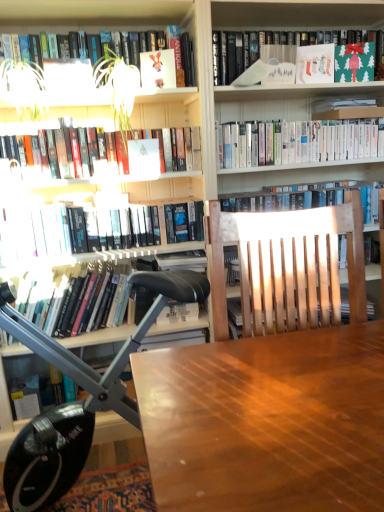
Describe the element at coordinates (96, 49) in the screenshot. This screenshot has height=512, width=384. I see `hardcover book at upper left, the sixth book positioned from the bottom` at that location.

Locate an element on the screen. Image resolution: width=384 pixels, height=512 pixels. hardcover book at upper center, placed as the third book when sorted from bottom to top is located at coordinates (286, 198).

Describe the element at coordinates (27, 127) in the screenshot. I see `hardcover books at upper left, arranged as the 4th book when viewed from the top` at that location.

Locate an element on the screen. This screenshot has width=384, height=512. green paper bag at upper right, marked as the 1th book in a top-to-bottom arrangement is located at coordinates (299, 58).

Find the location of `green leafy plant at upper left`. green leafy plant at upper left is located at coordinates (118, 88).

Which is less distant, (x=239, y=137) or (x=378, y=185)?

Point (x=239, y=137) is positioned closer to the camera compared to point (x=378, y=185).

In terms of size, does white glossy bookshelf at upper center, the 3th book viewed from the top, appear bigger or smaller than hardcover book at upper center, placed as the third book when sorted from bottom to top?

Clearly, white glossy bookshelf at upper center, the 3th book viewed from the top, is smaller in size than hardcover book at upper center, placed as the third book when sorted from bottom to top.

From the image's perspective, who appears lower, white glossy bookshelf at upper center, the 3th book viewed from the top, or hardcover book at upper center, placed as the third book when sorted from bottom to top?

hardcover book at upper center, placed as the third book when sorted from bottom to top, appears lower in the image.

From a real-world perspective, which book is the 1st one underneath the white glossy bookshelf at upper center, the 3th book viewed from the top? Please provide its 2D coordinates.

[(286, 198)]

Based on the photo, from the image's perspective, would you say wooden table at center is shown under matte white book at upper center, which is counted as the 4th paperback book, starting from the right?

Indeed, from the image's perspective, wooden table at center is shown beneath matte white book at upper center, which is counted as the 4th paperback book, starting from the right.

From a real-world perspective, does wooden table at center sit lower than matte white book at upper center, arranged as the first paperback book when viewed from the left?

Yes, from a real-world perspective, wooden table at center is below matte white book at upper center, arranged as the first paperback book when viewed from the left.

Does wooden table at center have a greater height compared to matte white book at upper center, which is counted as the 4th paperback book, starting from the right?

Indeed, wooden table at center has a greater height compared to matte white book at upper center, which is counted as the 4th paperback book, starting from the right.

Between point (316, 368) and point (173, 52), which one is positioned behind?

The point (173, 52) is farther.

Is white glossy bookshelf at upper center, which is the fifth book in bottom-to-top order, at the back of white paper at upper left, which ranks as the second book in bottom-to-top order?

That's not correct — white paper at upper left, which ranks as the second book in bottom-to-top order, is not looking away from white glossy bookshelf at upper center, which is the fifth book in bottom-to-top order.

Is white paper at upper left, acting as the sixth book starting from the top, not close to white glossy bookshelf at upper center, which is the fifth book in bottom-to-top order?

Actually, white paper at upper left, acting as the sixth book starting from the top, and white glossy bookshelf at upper center, which is the fifth book in bottom-to-top order, are a little close together.

Locate an element on the screen. The width and height of the screenshot is (384, 512). book that is the 2nd one above the white paper at upper left, acting as the sixth book starting from the top (from a real-world perspective) is located at coordinates (326, 141).

Where is `the 3rd book in front of the hardcover book at upper center, placed as the third book when sorted from bottom to top, counting from the anchor's position`? the 3rd book in front of the hardcover book at upper center, placed as the third book when sorted from bottom to top, counting from the anchor's position is located at coordinates (178, 258).

Considering the relative positions of hardcover book at upper center, placed as the third book when sorted from bottom to top, and hardcover book at left, which appears as the 7th book when viewed from the top, in the image provided, is hardcover book at upper center, placed as the third book when sorted from bottom to top, behind hardcover book at left, which appears as the 7th book when viewed from the top,?

That is True.

Is hardcover book at upper center, placed as the third book when sorted from bottom to top, turned away from hardcover book at left, which appears as the 7th book when viewed from the top?

No, hardcover book at upper center, placed as the third book when sorted from bottom to top,'s orientation is not away from hardcover book at left, which appears as the 7th book when viewed from the top.

Is hardcover book at upper center, placed as the third book when sorted from bottom to top, outside of green matte paper at upper right, marked as the 1th paperback book in a right-to-left arrangement?

That's correct, hardcover book at upper center, placed as the third book when sorted from bottom to top, is outside of green matte paper at upper right, marked as the 1th paperback book in a right-to-left arrangement.

How different are the orientations of hardcover book at upper center, placed as the third book when sorted from bottom to top, and green matte paper at upper right, marked as the 1th paperback book in a right-to-left arrangement, in degrees?

They differ by 25.4 degrees in their facing directions.

The height and width of the screenshot is (512, 384). I want to click on book that is the 4th object located below the green matte paper at upper right, marked as the 1th paperback book in a right-to-left arrangement (from the image's perspective), so click(286, 198).

Is hardcover book at upper center, the fifth book from the top, oriented towards green matte paper at upper right, marked as the 1th paperback book in a right-to-left arrangement?

No, hardcover book at upper center, the fifth book from the top, is not oriented towards green matte paper at upper right, marked as the 1th paperback book in a right-to-left arrangement.

Considering the sizes of objects white glossy bookshelf at upper center, the 3th book viewed from the top, and matte paper stocking at upper right, marked as the 3th paperback book in a left-to-right arrangement, in the image provided, who is thinner, white glossy bookshelf at upper center, the 3th book viewed from the top, or matte paper stocking at upper right, marked as the 3th paperback book in a left-to-right arrangement,?

Thinner between the two is matte paper stocking at upper right, marked as the 3th paperback book in a left-to-right arrangement.

Is white glossy bookshelf at upper center, which is the fifth book in bottom-to-top order, far from matte paper stocking at upper right, marked as the 3th paperback book in a left-to-right arrangement?

No.

Could you tell me if white glossy bookshelf at upper center, which is the fifth book in bottom-to-top order, is turned towards matte paper stocking at upper right, arranged as the 2th paperback book when viewed from the right?

No, white glossy bookshelf at upper center, which is the fifth book in bottom-to-top order, is not oriented towards matte paper stocking at upper right, arranged as the 2th paperback book when viewed from the right.

Is point (330, 143) in front of point (326, 47)?

No, it is not.

Between wooden table at center and green paper bag at upper right, marked as the 1th book in a top-to-bottom arrangement, which one appears on the right side from the viewer's perspective?

green paper bag at upper right, marked as the 1th book in a top-to-bottom arrangement.

How distant is wooden table at center from green paper bag at upper right, which is the seventh book from bottom to top?

wooden table at center is 4.31 feet away from green paper bag at upper right, which is the seventh book from bottom to top.

Does wooden table at center have a greater height compared to green paper bag at upper right, which is the seventh book from bottom to top?

Correct, wooden table at center is much taller as green paper bag at upper right, which is the seventh book from bottom to top.

Looking at this image, considering the relative sizes of wooden table at center and green paper bag at upper right, which is the seventh book from bottom to top, in the image provided, is wooden table at center thinner than green paper bag at upper right, which is the seventh book from bottom to top,?

No, wooden table at center is not thinner than green paper bag at upper right, which is the seventh book from bottom to top.

This screenshot has width=384, height=512. What are the coordinates of `book that is the 1st one below the white glossy bookshelf at upper center, the 3th book viewed from the top (from a real-world perspective)` in the screenshot? It's located at (286, 198).

From the image's perspective, starting from the wooden table at center, which paperback book is the 1st one above? Please provide its 2D coordinates.

[(158, 69)]

Based on their spatial positions, is matte paper stocking at upper right, arranged as the 2th paperback book when viewed from the right, or hardcover books at upper left, placed as the fourth book when sorted from bottom to top, further from white glossy bookshelf at upper center, the 3th book viewed from the top?

The object further to white glossy bookshelf at upper center, the 3th book viewed from the top, is hardcover books at upper left, placed as the fourth book when sorted from bottom to top.

Based on the photo, when comparing their distances from white paper at upper left, which ranks as the second book in bottom-to-top order, does green leafy plant at upper left or green matte paper at upper right, marked as the 1th paperback book in a right-to-left arrangement, seem further?

The object further to white paper at upper left, which ranks as the second book in bottom-to-top order, is green matte paper at upper right, marked as the 1th paperback book in a right-to-left arrangement.

Considering their positions, is hardcover book at left, which appears as the 7th book when viewed from the top, positioned further to matte paper stocking at upper right, marked as the 3th paperback book in a left-to-right arrangement, than hardcover books at upper left, arranged as the 4th book when viewed from the top?

The object further to matte paper stocking at upper right, marked as the 3th paperback book in a left-to-right arrangement, is hardcover book at left, which appears as the 7th book when viewed from the top.

Looking at the image, which one is located closer to green paper bag at upper right, which is the seventh book from bottom to top, black leather chair at left or hardcover book at left, which appears as the 7th book when viewed from the top?

hardcover book at left, which appears as the 7th book when viewed from the top.

Based on their spatial positions, is matte white book at upper center, arranged as the first paperback book when viewed from the left, or matte paper at upper center, the third paperback book when ordered from right to left, closer to green matte paper at upper right, which is the 4th paperback book from left to right?

matte paper at upper center, the third paperback book when ordered from right to left, lies closer to green matte paper at upper right, which is the 4th paperback book from left to right, than the other object.

When comparing their distances from white paper at upper left, which ranks as the second book in bottom-to-top order, does black leather chair at left or hardcover books at upper left, arranged as the 4th book when viewed from the top, seem closer?

Among the two, hardcover books at upper left, arranged as the 4th book when viewed from the top, is located nearer to white paper at upper left, which ranks as the second book in bottom-to-top order.

Looking at the image, which one is located closer to matte white book at upper center, arranged as the first paperback book when viewed from the left, matte paper at upper center, the third paperback book when ordered from right to left, or hardcover book at upper left, the sixth book positioned from the bottom?

Among the two, hardcover book at upper left, the sixth book positioned from the bottom, is located nearer to matte white book at upper center, arranged as the first paperback book when viewed from the left.

From the image, which object appears to be farther from white paper at upper left, which ranks as the second book in bottom-to-top order, hardcover book at upper center, placed as the third book when sorted from bottom to top, or hardcover book at upper left, the sixth book positioned from the bottom?

hardcover book at upper center, placed as the third book when sorted from bottom to top.

Locate an element on the screen. This screenshot has height=512, width=384. plant located between wooden table at center and white glossy bookshelf at upper center, which is the fifth book in bottom-to-top order, in the depth direction is located at coordinates (118, 88).

Where is `plant between hardcover books at upper left, arranged as the 4th book when viewed from the top, and green paper bag at upper right, which is the seventh book from bottom to top, in the horizontal direction`? The height and width of the screenshot is (512, 384). plant between hardcover books at upper left, arranged as the 4th book when viewed from the top, and green paper bag at upper right, which is the seventh book from bottom to top, in the horizontal direction is located at coordinates (118, 88).

Where is `computer chair between wooden table at center and white paper at upper left, which ranks as the second book in bottom-to-top order, from front to back`? computer chair between wooden table at center and white paper at upper left, which ranks as the second book in bottom-to-top order, from front to back is located at coordinates [x=76, y=401].

Locate an element on the screen. This screenshot has width=384, height=512. plant between hardcover books at upper left, placed as the fourth book when sorted from bottom to top, and green matte paper at upper right, marked as the 1th paperback book in a right-to-left arrangement, from left to right is located at coordinates (118, 88).